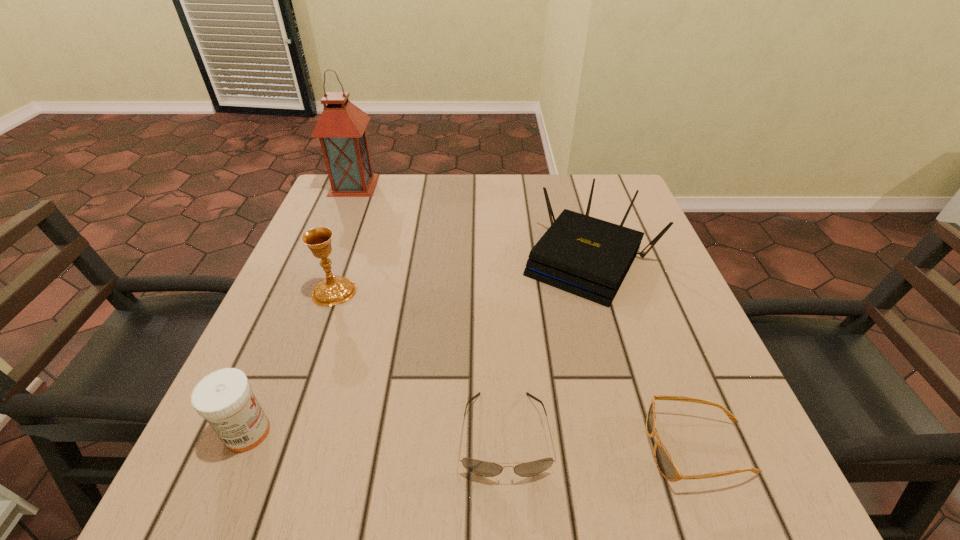
I want to click on vacant space at the near left corner of the desktop, so click(x=194, y=484).

The image size is (960, 540). What are the coordinates of `vacant space at the far right corner of the desktop` in the screenshot? It's located at (601, 186).

Where is `vacant space that's between the router and the farthest object`? The width and height of the screenshot is (960, 540). vacant space that's between the router and the farthest object is located at coordinates (471, 222).

Where is `vacant space that is in between the left sunglasses and the right sunglasses`? This screenshot has width=960, height=540. vacant space that is in between the left sunglasses and the right sunglasses is located at coordinates (602, 441).

Locate an element on the screen. The width and height of the screenshot is (960, 540). vacant region between the chalice and the right sunglasses is located at coordinates (516, 370).

The height and width of the screenshot is (540, 960). I want to click on unoccupied position between the left sunglasses and the router, so click(547, 347).

Where is `empty location between the chalice and the tallest object`? The height and width of the screenshot is (540, 960). empty location between the chalice and the tallest object is located at coordinates (344, 238).

At what (x,y) coordinates should I click in order to perform the action: click on empty space between the medicine and the left sunglasses. Please return your answer as a coordinate pair (x, y). Image resolution: width=960 pixels, height=540 pixels. Looking at the image, I should click on (376, 433).

Locate an element on the screen. This screenshot has height=540, width=960. vacant area that lies between the router and the right sunglasses is located at coordinates (644, 354).

This screenshot has width=960, height=540. In order to click on empty space that is in between the router and the right sunglasses in this screenshot , I will do `click(644, 354)`.